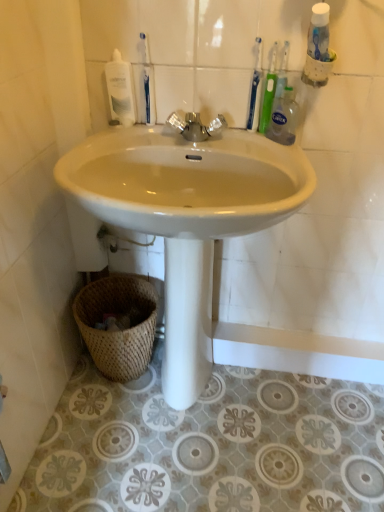
Identify the location of vacant area that lies between clear plastic bottle at upper right and silver metallic faucet at center. (245, 143).